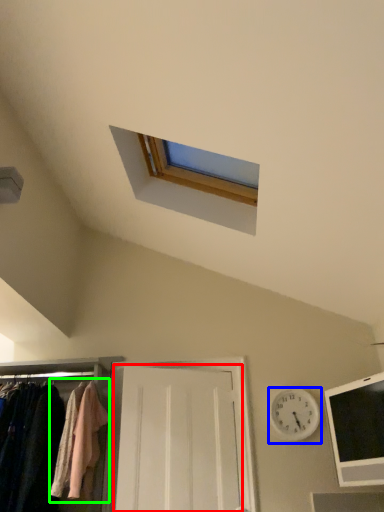
Question: Which is nearer to the door (highlighted by a red box)? clock (highlighted by a blue box) or clothing (highlighted by a green box).

Choices:
 (A) clock
 (B) clothing

Answer: (B)